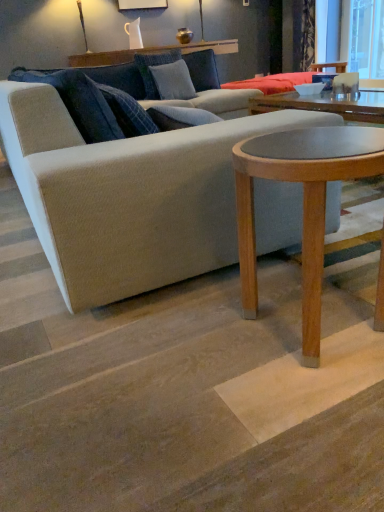
The image size is (384, 512). What do you see at coordinates (366, 39) in the screenshot?
I see `transparent glass window screen at upper right` at bounding box center [366, 39].

Measure the distance between textured gray pillow at center, which is counted as the second pillow, starting from the back, and camera.

The distance of textured gray pillow at center, which is counted as the second pillow, starting from the back, from camera is 3.61 meters.

Measure the distance between point (306, 360) and camera.

Point (306, 360) is 3.35 feet away from camera.

Where is `light brown wood coffee table at center`? light brown wood coffee table at center is located at coordinates (303, 203).

The image size is (384, 512). Identify the location of textured blue pillow at upper center, the 2th pillow when ordered from front to back. (154, 65).

Locate an element on the screen. The width and height of the screenshot is (384, 512). velvet dark blue curtain at upper right is located at coordinates (303, 34).

Does textured gray pillow at center, acting as the 1th pillow starting from the front, have a greater width compared to velvet dark blue curtain at upper right?

No, textured gray pillow at center, acting as the 1th pillow starting from the front, is not wider than velvet dark blue curtain at upper right.

Does point (155, 83) lie in front of point (293, 44)?

Yes, point (155, 83) is closer to viewer.

Could you tell me if textured gray pillow at center, which is counted as the second pillow, starting from the back, is turned towards velvet dark blue curtain at upper right?

No.

Looking at the image, does light brown wood coffee table at center seem bigger or smaller compared to textured gray pillow at center, acting as the 1th pillow starting from the front?

light brown wood coffee table at center is bigger than textured gray pillow at center, acting as the 1th pillow starting from the front.

From a real-world perspective, is light brown wood coffee table at center on textured gray pillow at center, which is counted as the second pillow, starting from the back?

No, from a real-world perspective, light brown wood coffee table at center is not above textured gray pillow at center, which is counted as the second pillow, starting from the back.

Who is taller, light brown wood coffee table at center or textured gray pillow at center, which is counted as the second pillow, starting from the back?

With more height is light brown wood coffee table at center.

Does point (246, 191) come in front of point (169, 75)?

Yes, it is in front of point (169, 75).

The width and height of the screenshot is (384, 512). Find the location of `window screen that is on the right side of velvet dark blue curtain at upper right`. window screen that is on the right side of velvet dark blue curtain at upper right is located at coordinates (366, 39).

Can you confirm if transparent glass window screen at upper right is shorter than velvet dark blue curtain at upper right?

No.

From the image's perspective, is transparent glass window screen at upper right beneath velvet dark blue curtain at upper right?

Correct, transparent glass window screen at upper right appears lower than velvet dark blue curtain at upper right in the image.

Could you tell me if transparent glass window screen at upper right is facing velvet dark blue curtain at upper right?

No, transparent glass window screen at upper right is not aimed at velvet dark blue curtain at upper right.

Is velvet dark blue curtain at upper right placed right next to transparent glass window screen at upper right?

No, velvet dark blue curtain at upper right is not beside transparent glass window screen at upper right.

Is velvet dark blue curtain at upper right shorter than transparent glass window screen at upper right?

Indeed, velvet dark blue curtain at upper right has a lesser height compared to transparent glass window screen at upper right.

From the image's perspective, is velvet dark blue curtain at upper right located above transparent glass window screen at upper right?

Yes, from the image's perspective, velvet dark blue curtain at upper right is above transparent glass window screen at upper right.

Which object is further away from the camera taking this photo, velvet dark blue curtain at upper right or transparent glass window screen at upper right?

velvet dark blue curtain at upper right is further away from the camera.

From the image's perspective, is textured blue pillow at upper center, the 2th pillow when ordered from front to back, under velvet dark blue curtain at upper right?

Correct, textured blue pillow at upper center, the 2th pillow when ordered from front to back, appears lower than velvet dark blue curtain at upper right in the image.

This screenshot has width=384, height=512. Find the location of `curtain behind the textured blue pillow at upper center, the 2th pillow when ordered from front to back`. curtain behind the textured blue pillow at upper center, the 2th pillow when ordered from front to back is located at coordinates (303, 34).

Would you say textured blue pillow at upper center, the 2th pillow when ordered from front to back, is outside velvet dark blue curtain at upper right?

Yes.

Could you measure the distance between textured blue pillow at upper center, arranged as the 1th pillow when viewed from the back, and velvet dark blue curtain at upper right?

textured blue pillow at upper center, arranged as the 1th pillow when viewed from the back, is 8.67 feet away from velvet dark blue curtain at upper right.

Is textured blue pillow at upper center, the 2th pillow when ordered from front to back, positioned in front of textured gray pillow at center, which is counted as the second pillow, starting from the back?

No.

Is textured blue pillow at upper center, the 2th pillow when ordered from front to back, bigger than textured gray pillow at center, acting as the 1th pillow starting from the front?

Correct, textured blue pillow at upper center, the 2th pillow when ordered from front to back, is larger in size than textured gray pillow at center, acting as the 1th pillow starting from the front.

Identify the location of pillow on the right of textured blue pillow at upper center, the 2th pillow when ordered from front to back. (173, 81).

Consider the image. From a real-world perspective, is textured blue pillow at upper center, the 2th pillow when ordered from front to back, positioned under textured gray pillow at center, which is counted as the second pillow, starting from the back, based on gravity?

No, from a real-world perspective, textured blue pillow at upper center, the 2th pillow when ordered from front to back, is not beneath textured gray pillow at center, which is counted as the second pillow, starting from the back.

Is the surface of textured blue pillow at upper center, arranged as the 1th pillow when viewed from the back, in direct contact with transparent glass window screen at upper right?

There is a gap between textured blue pillow at upper center, arranged as the 1th pillow when viewed from the back, and transparent glass window screen at upper right.

Does textured blue pillow at upper center, arranged as the 1th pillow when viewed from the back, turn towards transparent glass window screen at upper right?

No, textured blue pillow at upper center, arranged as the 1th pillow when viewed from the back, is not facing towards transparent glass window screen at upper right.

How many degrees apart are the facing directions of textured blue pillow at upper center, the 2th pillow when ordered from front to back, and transparent glass window screen at upper right?

They differ by 90.4 degrees in their facing directions.

Does textured blue pillow at upper center, the 2th pillow when ordered from front to back, have a greater width compared to transparent glass window screen at upper right?

Indeed, textured blue pillow at upper center, the 2th pillow when ordered from front to back, has a greater width compared to transparent glass window screen at upper right.

You are a GUI agent. You are given a task and a screenshot of the screen. Output one action in this format:
    pyautogui.click(x=<x>, y=<y>)
    Task: Click on the curtain located above the textured gray pillow at center, which is counted as the second pillow, starting from the back (from the image's perspective)
    This screenshot has height=512, width=384.
    Given the screenshot: What is the action you would take?
    pyautogui.click(x=303, y=34)

Find the location of a particular element. coffee table located on the right of textured gray pillow at center, which is counted as the second pillow, starting from the back is located at coordinates (303, 203).

Looking at the image, which one is located closer to light brown wood coffee table at center, beige fabric couch at center or velvet dark blue curtain at upper right?

Answer: beige fabric couch at center is positioned closer to the anchor light brown wood coffee table at center.

Based on their spatial positions, is transparent glass window screen at upper right or velvet dark blue curtain at upper right further from beige fabric couch at center?

velvet dark blue curtain at upper right lies further to beige fabric couch at center than the other object.

Based on their spatial positions, is beige fabric couch at center or velvet dark blue curtain at upper right closer to transparent glass window screen at upper right?

velvet dark blue curtain at upper right is positioned closer to the anchor transparent glass window screen at upper right.

Looking at the image, which one is located further to velvet dark blue curtain at upper right, textured gray pillow at center, which is counted as the second pillow, starting from the back, or light brown wood coffee table at center?

The object further to velvet dark blue curtain at upper right is light brown wood coffee table at center.

Looking at this image, which object lies further to the anchor point light brown wood coffee table at center, textured blue pillow at upper center, the 2th pillow when ordered from front to back, or beige fabric couch at center?

textured blue pillow at upper center, the 2th pillow when ordered from front to back.

Which object lies nearer to the anchor point textured gray pillow at center, which is counted as the second pillow, starting from the back, textured blue pillow at upper center, arranged as the 1th pillow when viewed from the back, or velvet dark blue curtain at upper right?

textured blue pillow at upper center, arranged as the 1th pillow when viewed from the back.

Which object lies further to the anchor point textured gray pillow at center, acting as the 1th pillow starting from the front, transparent glass window screen at upper right or beige fabric couch at center?

transparent glass window screen at upper right is further to textured gray pillow at center, acting as the 1th pillow starting from the front.

From the image, which object appears to be farther from textured blue pillow at upper center, arranged as the 1th pillow when viewed from the back, textured gray pillow at center, which is counted as the second pillow, starting from the back, or beige fabric couch at center?

The object further to textured blue pillow at upper center, arranged as the 1th pillow when viewed from the back, is beige fabric couch at center.

Find the location of a particular element. window screen between light brown wood coffee table at center and velvet dark blue curtain at upper right along the z-axis is located at coordinates (366, 39).

In order to click on pillow located between light brown wood coffee table at center and textured blue pillow at upper center, the 2th pillow when ordered from front to back, in the depth direction in this screenshot , I will do `click(173, 81)`.

You are a GUI agent. You are given a task and a screenshot of the screen. Output one action in this format:
    pyautogui.click(x=<x>, y=<y>)
    Task: Click on the studio couch between light brown wood coffee table at center and transparent glass window screen at upper right along the z-axis
    Image resolution: width=384 pixels, height=512 pixels.
    Given the screenshot: What is the action you would take?
    pyautogui.click(x=131, y=187)

Where is `pillow between beige fabric couch at center and textured blue pillow at upper center, arranged as the 1th pillow when viewed from the back, along the z-axis`? The image size is (384, 512). pillow between beige fabric couch at center and textured blue pillow at upper center, arranged as the 1th pillow when viewed from the back, along the z-axis is located at coordinates (173, 81).